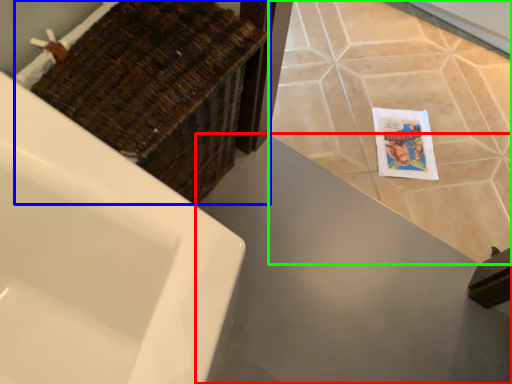
Question: Estimate the real-world distances between objects in this image. Which object is farther from counter top (highlighted by a red box), basket (highlighted by a blue box) or ceramic tile (highlighted by a green box)?

Choices:
 (A) basket
 (B) ceramic tile

Answer: (A)